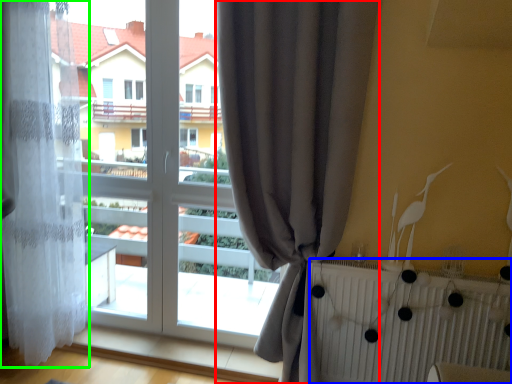
Question: Estimate the real-world distances between objects in this image. Which object is farther from curtain (highlighted by a red box), radiator (highlighted by a blue box) or curtain (highlighted by a green box)?

Choices:
 (A) radiator
 (B) curtain

Answer: (B)